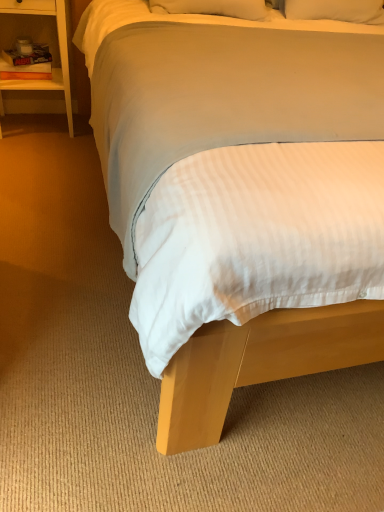
The height and width of the screenshot is (512, 384). Find the location of `white wood nightstand at left`. white wood nightstand at left is located at coordinates (59, 49).

The image size is (384, 512). Describe the element at coordinates (59, 49) in the screenshot. I see `white wood nightstand at left` at that location.

What are the coordinates of `white soft bed at center` in the screenshot? It's located at (258, 364).

Image resolution: width=384 pixels, height=512 pixels. What do you see at coordinates (258, 364) in the screenshot? I see `white soft bed at center` at bounding box center [258, 364].

The width and height of the screenshot is (384, 512). Find the location of `white wood nightstand at left`. white wood nightstand at left is located at coordinates (59, 49).

Which is more to the right, white soft bed at center or white wood nightstand at left?

white soft bed at center is more to the right.

Is white soft bed at center closer to the viewer compared to white wood nightstand at left?

Yes, white soft bed at center is closer to the viewer.

Is point (103, 4) closer or farther from the camera than point (67, 88)?

Point (103, 4) is positioned closer to the camera compared to point (67, 88).

From the image's perspective, would you say white soft bed at center is shown under white wood nightstand at left?

Yes, from the image's perspective, white soft bed at center is beneath white wood nightstand at left.

From a real-world perspective, is white soft bed at center positioned over white wood nightstand at left based on gravity?

Yes, from a real-world perspective, white soft bed at center is on top of white wood nightstand at left.

Does white soft bed at center have a greater width compared to white wood nightstand at left?

Yes, white soft bed at center is wider than white wood nightstand at left.

Is white soft bed at center shorter than white wood nightstand at left?

No, white soft bed at center is not shorter than white wood nightstand at left.

Considering the relative sizes of white soft bed at center and white wood nightstand at left in the image provided, is white soft bed at center bigger than white wood nightstand at left?

Yes.

Which is correct: white soft bed at center is inside white wood nightstand at left, or outside of it?

white soft bed at center is not enclosed by white wood nightstand at left.

Is white soft bed at center placed right next to white wood nightstand at left?

No, white soft bed at center is not in contact with white wood nightstand at left.

From the picture: Could you tell me if white soft bed at center is facing white wood nightstand at left?

No, white soft bed at center is not aimed at white wood nightstand at left.

Consider the image. How different are the orientations of white soft bed at center and white wood nightstand at left in degrees?

The angle between the facing direction of white soft bed at center and the facing direction of white wood nightstand at left is 0.365 degrees.

How much distance is there between white soft bed at center and white wood nightstand at left?

A distance of 1.83 meters exists between white soft bed at center and white wood nightstand at left.

Locate an element on the screen. The width and height of the screenshot is (384, 512). bed located in front of the white wood nightstand at left is located at coordinates (258, 364).

Can you confirm if white wood nightstand at left is positioned to the right of white soft bed at center?

In fact, white wood nightstand at left is to the left of white soft bed at center.

Relative to white soft bed at center, is white wood nightstand at left in front or behind?

Clearly, white wood nightstand at left is behind white soft bed at center.

Does point (52, 81) appear closer or farther from the camera than point (352, 306)?

Clearly, point (52, 81) is more distant from the camera than point (352, 306).

From the image's perspective, is white wood nightstand at left located above or below white soft bed at center?

Clearly, from the image's perspective, white wood nightstand at left is above white soft bed at center.

From a real-world perspective, which object rests below the other?

white wood nightstand at left.

Does white wood nightstand at left have a greater width compared to white soft bed at center?

No, white wood nightstand at left is not wider than white soft bed at center.

Between white wood nightstand at left and white soft bed at center, which one has more height?

With more height is white soft bed at center.

Looking at the image, does white wood nightstand at left seem bigger or smaller compared to white soft bed at center?

In the image, white wood nightstand at left appears to be smaller than white soft bed at center.

Is white wood nightstand at left not inside white soft bed at center?

That's correct, white wood nightstand at left is outside of white soft bed at center.

Would you consider white wood nightstand at left to be distant from white soft bed at center?

white wood nightstand at left is far away from white soft bed at center.

Based on the photo, is white wood nightstand at left facing away from white soft bed at center?

white wood nightstand at left is not turned away from white soft bed at center.

Can you tell me how much white wood nightstand at left and white soft bed at center differ in facing direction?

white wood nightstand at left and white soft bed at center are facing 0.365 degrees away from each other.

What are the coordinates of `bed above the white wood nightstand at left (from a real-world perspective)` in the screenshot? It's located at (258, 364).

Locate an element on the screen. bed that appears below the white wood nightstand at left (from the image's perspective) is located at coordinates (258, 364).

Locate an element on the screen. This screenshot has height=512, width=384. nightstand behind the white soft bed at center is located at coordinates (59, 49).